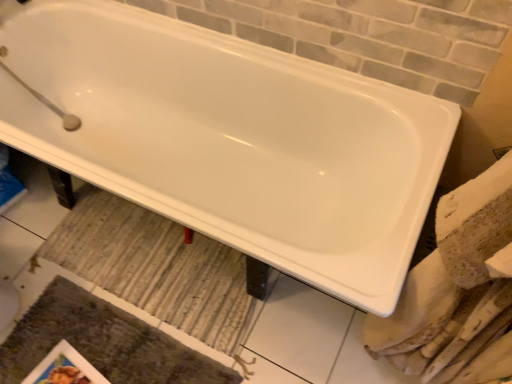
At what (x,y) coordinates should I click in order to perform the action: click on free point above textured gray bath mat at lower left, which is the 1th bath mat in bottom-to-top order (from a real-world perspective). Please return your answer as a coordinate pair (x, y). This screenshot has width=512, height=384. Looking at the image, I should click on (101, 350).